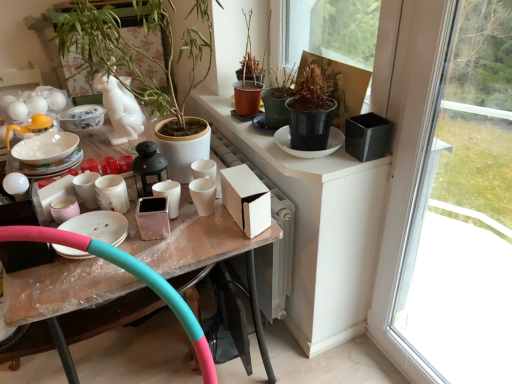
At what (x,y) coordinates should I click in order to perform the action: click on free space in front of terracotta pot at upper center, the first houseplant viewed from the right. Please return your answer as a coordinate pair (x, y). This screenshot has width=512, height=384. Looking at the image, I should click on (252, 131).